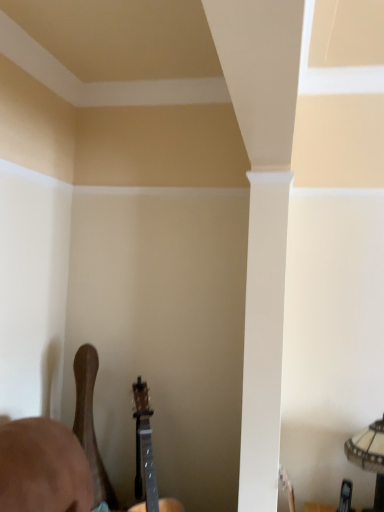
Question: Is glass textured lampshade at lower right inside or outside of wooden acoustic guitar at lower left, arranged as the second guitar when viewed from the right?

Choices:
 (A) outside
 (B) inside

Answer: (A)

Question: Relative to wooden acoustic guitar at lower left, arranged as the second guitar when viewed from the right, is glass textured lampshade at lower right in front or behind?

Choices:
 (A) behind
 (B) front

Answer: (B)

Question: Based on their relative distances, which object is farther from the glass textured lampshade at lower right?

Choices:
 (A) wooden acoustic guitar at lower center, which is the 2th guitar from left to right
 (B) wooden acoustic guitar at lower left, the 1th guitar when ordered from left to right

Answer: (B)

Question: Based on their relative distances, which object is nearer to the wooden acoustic guitar at lower left, the 1th guitar when ordered from left to right?

Choices:
 (A) glass textured lampshade at lower right
 (B) wooden acoustic guitar at lower center, which is the 2th guitar from left to right

Answer: (B)